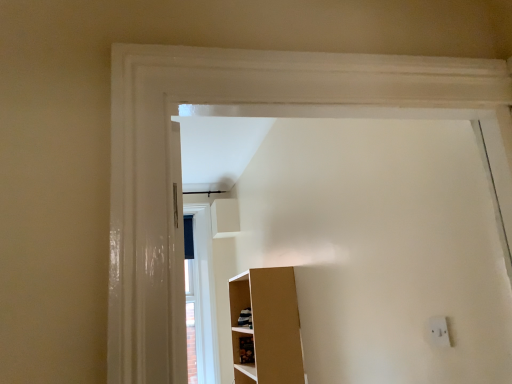
Question: In the image, is white plastic electric outlet at lower right on the left side or the right side of wooden cabinet at lower center?

Choices:
 (A) right
 (B) left

Answer: (A)

Question: In the image, is white plastic electric outlet at lower right positioned in front of or behind wooden cabinet at lower center?

Choices:
 (A) behind
 (B) front

Answer: (B)

Question: From a real-world perspective, is white plastic electric outlet at lower right positioned above or below wooden cabinet at lower center?

Choices:
 (A) below
 (B) above

Answer: (B)

Question: In terms of size, does wooden cabinet at lower center appear bigger or smaller than white plastic electric outlet at lower right?

Choices:
 (A) big
 (B) small

Answer: (A)

Question: Considering the positions of wooden cabinet at lower center and white plastic electric outlet at lower right in the image, is wooden cabinet at lower center taller or shorter than white plastic electric outlet at lower right?

Choices:
 (A) short
 (B) tall

Answer: (B)

Question: Is point (249, 355) positioned closer to the camera than point (434, 344)?

Choices:
 (A) closer
 (B) farther

Answer: (B)

Question: Considering their positions, is wooden cabinet at lower center located in front of or behind white plastic electric outlet at lower right?

Choices:
 (A) behind
 (B) front

Answer: (A)